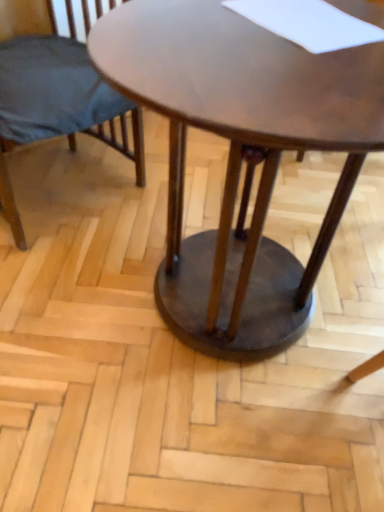
Question: From the image's perspective, is matte dark blue fabric chair at left positioned above or below shiny brown wood coffee table at center?

Choices:
 (A) above
 (B) below

Answer: (A)

Question: Does point (66, 61) appear closer or farther from the camera than point (254, 290)?

Choices:
 (A) closer
 (B) farther

Answer: (B)

Question: Is matte dark blue fabric chair at left bigger or smaller than shiny brown wood coffee table at center?

Choices:
 (A) big
 (B) small

Answer: (B)

Question: In the image, is shiny brown wood coffee table at center on the left side or the right side of matte dark blue fabric chair at left?

Choices:
 (A) left
 (B) right

Answer: (B)

Question: Is point (283, 273) closer or farther from the camera than point (115, 93)?

Choices:
 (A) farther
 (B) closer

Answer: (A)

Question: Is shiny brown wood coffee table at center taller or shorter than matte dark blue fabric chair at left?

Choices:
 (A) short
 (B) tall

Answer: (B)

Question: Looking at their shapes, would you say shiny brown wood coffee table at center is wider or thinner than matte dark blue fabric chair at left?

Choices:
 (A) thin
 (B) wide

Answer: (B)